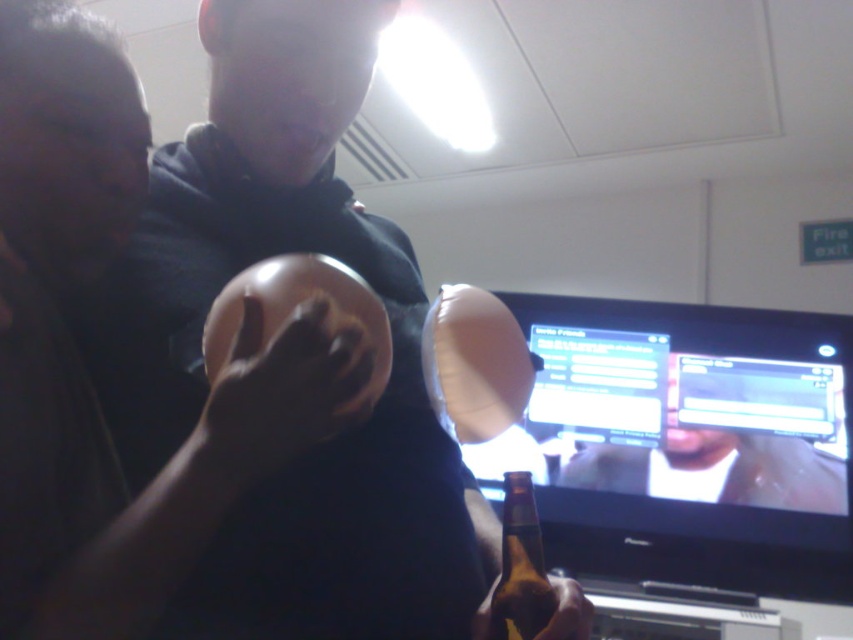
Is matte brown helmet at center to the left of smooth leather jacket at upper right from the viewer's perspective?

Indeed, matte brown helmet at center is positioned on the left side of smooth leather jacket at upper right.

Who is positioned more to the right, matte brown helmet at center or smooth leather jacket at upper right?

Positioned to the right is smooth leather jacket at upper right.

Who is more forward, (51, 337) or (785, 451)?

Positioned in front is point (51, 337).

Find the location of a particular element. The height and width of the screenshot is (640, 853). matte brown helmet at center is located at coordinates (80, 365).

Does matte plastic monitor at center appear on the right side of smooth leather jacket at upper right?

In fact, matte plastic monitor at center is to the left of smooth leather jacket at upper right.

Where is `matte plastic monitor at center`? This screenshot has width=853, height=640. matte plastic monitor at center is located at coordinates (693, 442).

Which of these two, matte brown helmet at center or brown glass bottle at lower center, stands taller?

With more height is matte brown helmet at center.

From the picture: Can you confirm if matte brown helmet at center is bigger than brown glass bottle at lower center?

Correct, matte brown helmet at center is larger in size than brown glass bottle at lower center.

Locate an element on the screen. matte brown helmet at center is located at coordinates (80, 365).

Where is `matte brown helmet at center`? This screenshot has height=640, width=853. matte brown helmet at center is located at coordinates (80, 365).